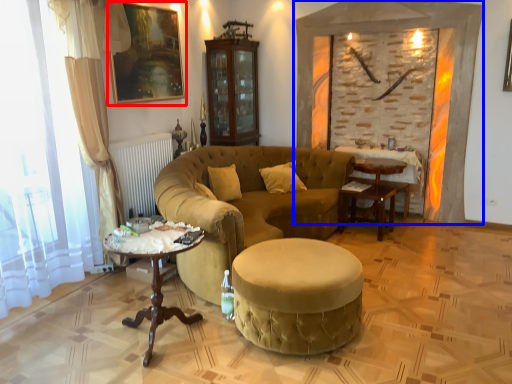
Question: Which object appears farthest to the camera in this image, picture frame (highlighted by a red box) or fireplace (highlighted by a blue box)?

Choices:
 (A) picture frame
 (B) fireplace

Answer: (B)